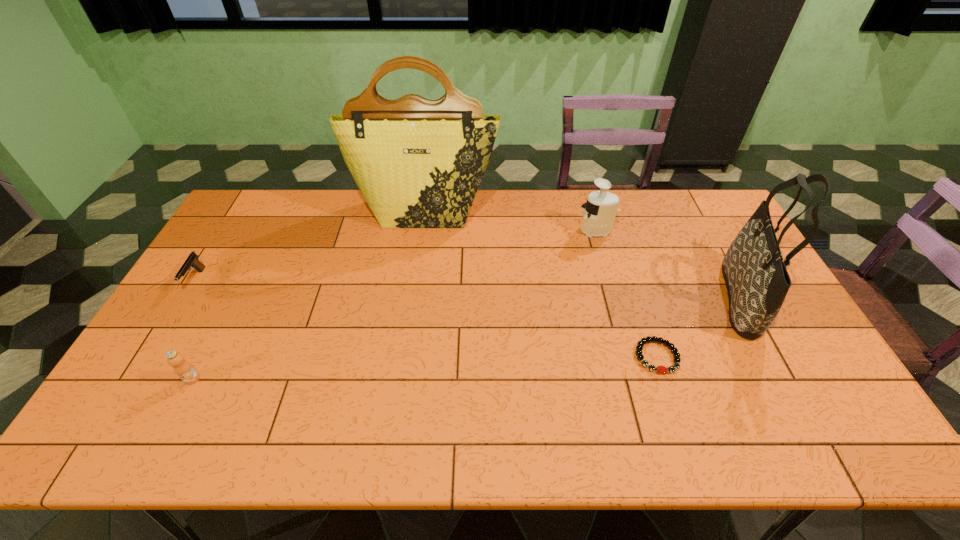
I want to click on free location that satisfies the following two spatial constraints: 1. on the front side of the fourth shortest object; 2. on the right side of the nearer tote bag, so click(x=615, y=297).

I want to click on free location that satisfies the following two spatial constraints: 1. on the front-facing side of the bracelet; 2. on the right side of the farther tote bag, so click(405, 356).

I want to click on vacant space that satisfies the following two spatial constraints: 1. on the front-facing side of the tallest object; 2. on the right side of the fourth shortest object, so click(422, 230).

In order to click on vacant space that satisfies the following two spatial constraints: 1. on the front-facing side of the farther tote bag; 2. on the left side of the fourth shortest object in this screenshot , I will do `click(422, 230)`.